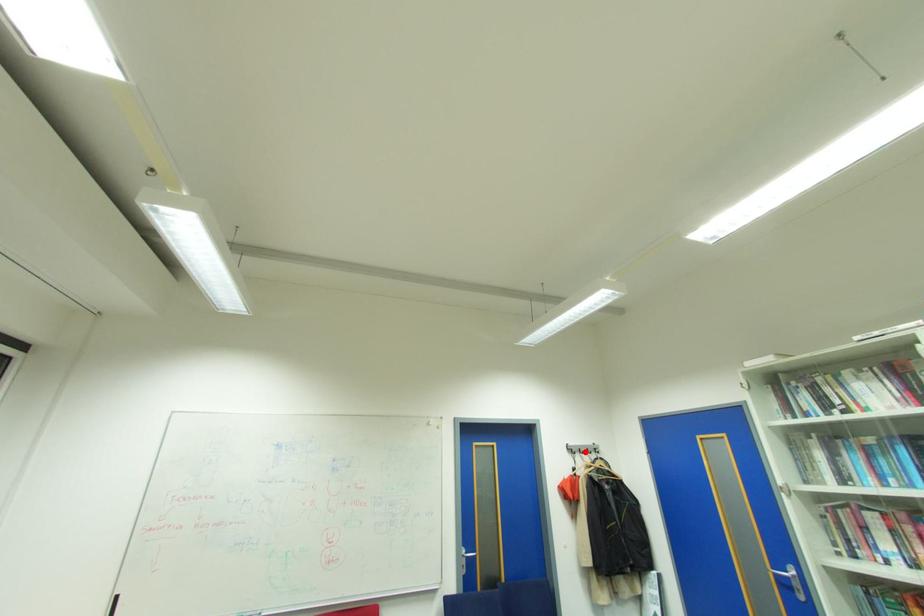
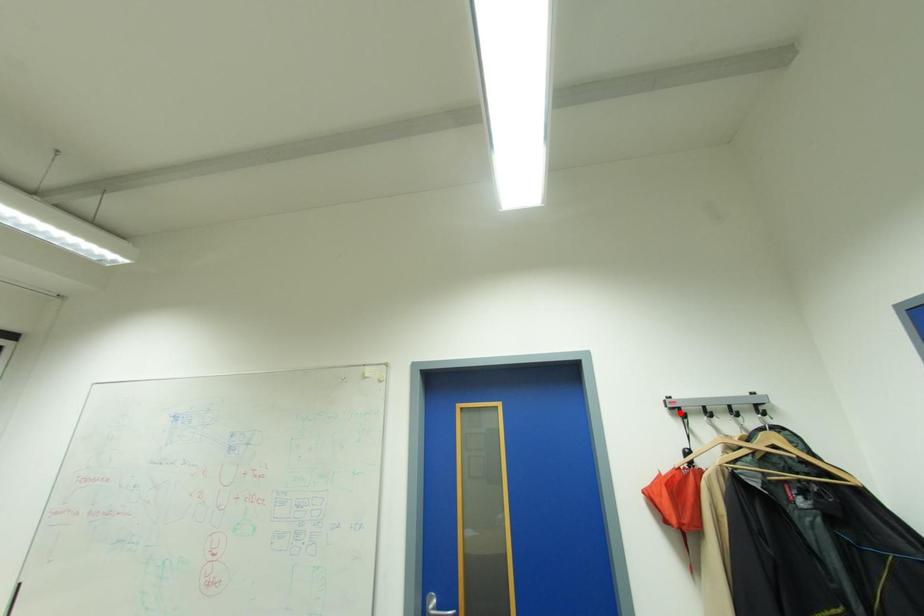
I am providing you with two images of the same scene from different viewpoints. A red point is marked on the first image and another point is marked on the second image. Does the point marked in image1 correspond to the same location as the one in image2?

No